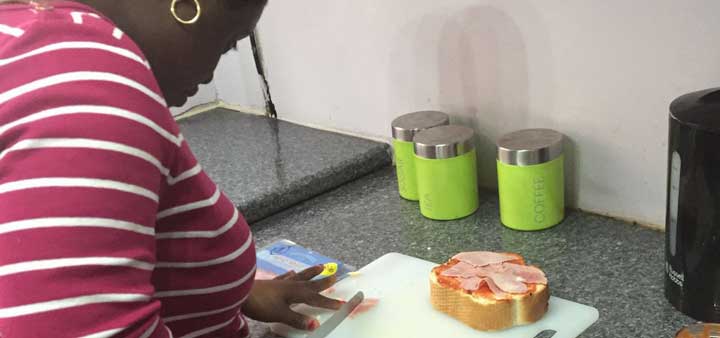
Identify the location of silver jar caps. (412, 124), (438, 134), (531, 143).